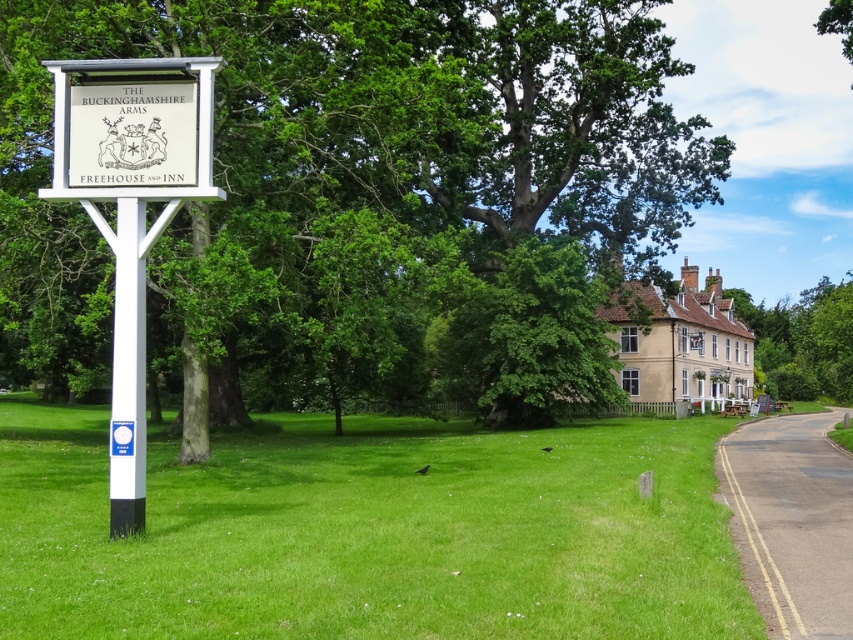
Does point (614, 97) lie in front of point (74, 136)?

No, (614, 97) is further to viewer.

Between point (403, 125) and point (85, 128), which one is positioned behind?

The point (403, 125) is more distant.

Between point (483, 349) and point (140, 106), which one is positioned behind?

Point (483, 349)

Find the location of a particular element. The image size is (853, 640). green leafy tree at upper center is located at coordinates (357, 186).

Between white wooden sign at upper left and green leafy tree at right, which one has less height?

Standing shorter between the two is white wooden sign at upper left.

In the scene shown: Who is more distant from viewer, (126, 99) or (817, 355)?

The point (817, 355) is behind.

The image size is (853, 640). What are the coordinates of `white wooden sign at upper left` in the screenshot? It's located at (132, 132).

Can you confirm if green grass at center is bigger than white plastic pole at left?

Indeed, green grass at center has a larger size compared to white plastic pole at left.

Looking at this image, is green grass at center positioned behind white plastic pole at left?

No.

This screenshot has height=640, width=853. Identify the location of green grass at center. (370, 532).

Where is `green grass at center`? This screenshot has height=640, width=853. green grass at center is located at coordinates (370, 532).